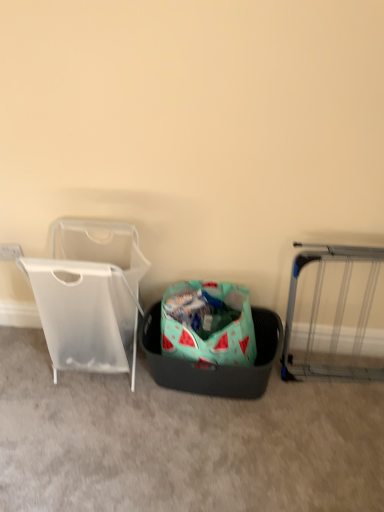
Question: From a real-world perspective, is transparent plastic laundry basket at left physically below teal fabric laundry basket at center?

Choices:
 (A) yes
 (B) no

Answer: (B)

Question: Considering the relative positions of transparent plastic laundry basket at left and teal fabric laundry basket at center in the image provided, is transparent plastic laundry basket at left to the right of teal fabric laundry basket at center from the viewer's perspective?

Choices:
 (A) no
 (B) yes

Answer: (A)

Question: From a real-world perspective, is transparent plastic laundry basket at left on teal fabric laundry basket at center?

Choices:
 (A) yes
 (B) no

Answer: (A)

Question: Is transparent plastic laundry basket at left positioned behind teal fabric laundry basket at center?

Choices:
 (A) yes
 (B) no

Answer: (B)

Question: Is the depth of transparent plastic laundry basket at left less than that of teal fabric laundry basket at center?

Choices:
 (A) no
 (B) yes

Answer: (B)

Question: Does transparent plastic laundry basket at left have a greater width compared to teal fabric laundry basket at center?

Choices:
 (A) yes
 (B) no

Answer: (B)

Question: Is silver metallic gate at right at the left side of teal fabric laundry basket at center?

Choices:
 (A) no
 (B) yes

Answer: (A)

Question: Can you confirm if silver metallic gate at right is positioned to the right of teal fabric laundry basket at center?

Choices:
 (A) yes
 (B) no

Answer: (A)

Question: From the image's perspective, is silver metallic gate at right above teal fabric laundry basket at center?

Choices:
 (A) yes
 (B) no

Answer: (A)

Question: Is silver metallic gate at right aimed at teal fabric laundry basket at center?

Choices:
 (A) yes
 (B) no

Answer: (B)

Question: From the image's perspective, is silver metallic gate at right beneath teal fabric laundry basket at center?

Choices:
 (A) yes
 (B) no

Answer: (B)

Question: From a real-world perspective, is silver metallic gate at right physically below teal fabric laundry basket at center?

Choices:
 (A) yes
 (B) no

Answer: (B)

Question: From the image's perspective, is teal fabric laundry basket at center located above silver metallic gate at right?

Choices:
 (A) no
 (B) yes

Answer: (A)